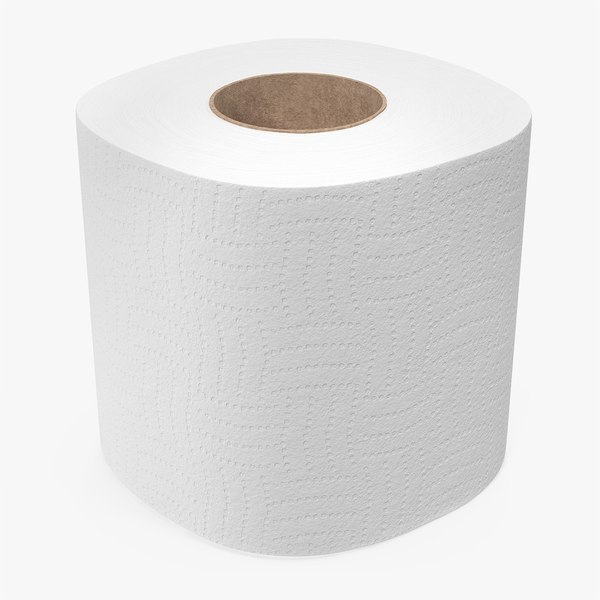
At what (x,y) coordinates should I click in order to perform the action: click on right upper edge of toilet paper. Please return your answer as a coordinate pair (x, y). The width and height of the screenshot is (600, 600). Looking at the image, I should click on click(x=531, y=118).